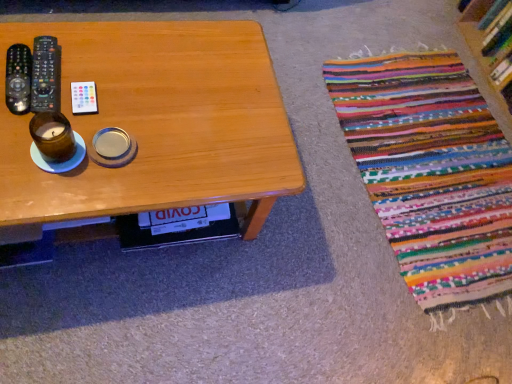
You are a GUI agent. You are given a task and a screenshot of the screen. Output one action in this format:
    pyautogui.click(x=<x>, y=<y>)
    Task: Click on the vacant point to the right of brown glass candle at left
    The image size is (512, 384).
    Given the screenshot: What is the action you would take?
    pyautogui.click(x=136, y=171)